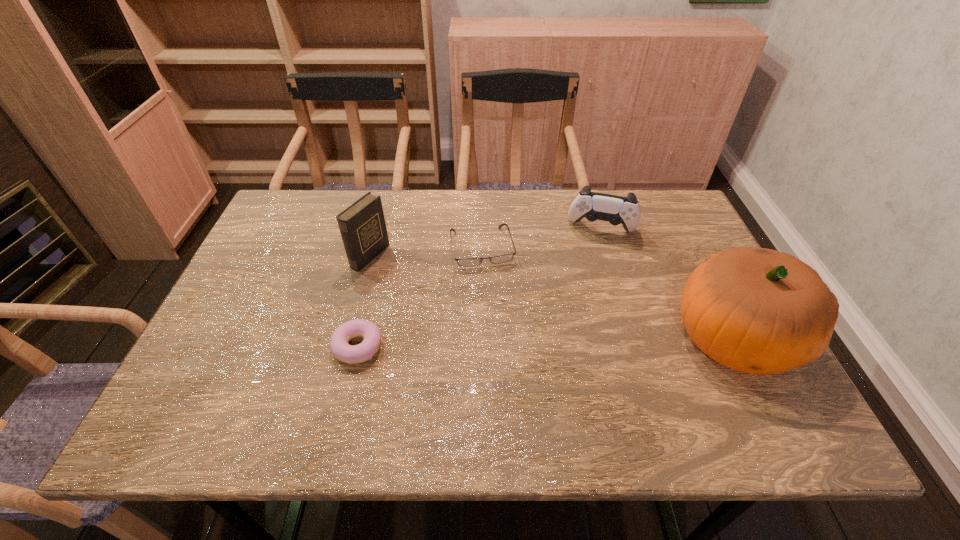
This screenshot has width=960, height=540. I want to click on doughnut, so click(352, 354).

At what (x,y) coordinates should I click in order to perform the action: click on the tallest object. Please return your answer as a coordinate pair (x, y). Looking at the image, I should click on (x=759, y=311).

Locate an element on the screen. This screenshot has height=540, width=960. diary is located at coordinates (362, 225).

This screenshot has height=540, width=960. What are the coordinates of `spectacles` in the screenshot? It's located at (x=466, y=262).

Where is `the third tallest object`? This screenshot has width=960, height=540. the third tallest object is located at coordinates (616, 210).

This screenshot has height=540, width=960. Find the location of `vacant area situated 0.240m on the back of the doughnut`. vacant area situated 0.240m on the back of the doughnut is located at coordinates (379, 259).

Locate an element on the screen. free region located 0.190m on the front cover of the diary is located at coordinates (442, 289).

You are a GUI agent. You are given a task and a screenshot of the screen. Output one action in this format:
    pyautogui.click(x=<x>, y=<y>)
    Task: Click on the vacant space located 0.340m on the front cover of the diary
    The height and width of the screenshot is (540, 960).
    Given the screenshot: What is the action you would take?
    pyautogui.click(x=492, y=312)

Locate an element on the screen. vacant area situated on the front cover of the diary is located at coordinates (397, 270).

Identify the location of vacant space located 0.360m on the front-facing side of the spectacles. (516, 387).